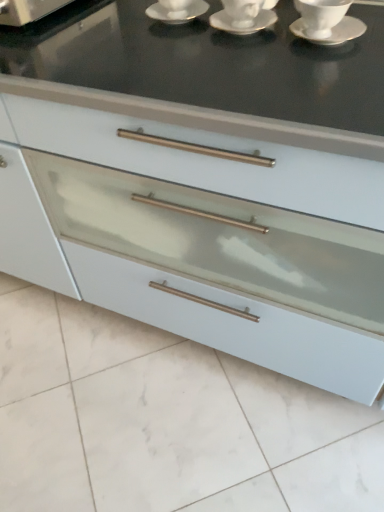
Question: Considering the relative sizes of white ceramic cup at upper right and white glossy saucer at upper right, which ranks as the first saucer in right-to-left order, in the image provided, is white ceramic cup at upper right thinner than white glossy saucer at upper right, which ranks as the first saucer in right-to-left order,?

Choices:
 (A) yes
 (B) no

Answer: (A)

Question: Is white ceramic cup at upper right facing away from white glossy saucer at upper right, which ranks as the first saucer in right-to-left order?

Choices:
 (A) yes
 (B) no

Answer: (B)

Question: Is white ceramic cup at upper right not close to white glossy saucer at upper right, the third saucer from the left?

Choices:
 (A) no
 (B) yes

Answer: (A)

Question: Is white ceramic cup at upper right smaller than white glossy saucer at upper right, the third saucer from the left?

Choices:
 (A) yes
 (B) no

Answer: (B)

Question: From a real-world perspective, is white ceramic cup at upper right positioned over white glossy saucer at upper right, which ranks as the first saucer in right-to-left order, based on gravity?

Choices:
 (A) no
 (B) yes

Answer: (B)

Question: Considering the positions of white ceramic cup at upper right and white ceramic saucer at upper center, the 1th saucer from the left, in the image, is white ceramic cup at upper right taller or shorter than white ceramic saucer at upper center, the 1th saucer from the left,?

Choices:
 (A) tall
 (B) short

Answer: (B)

Question: Looking at their shapes, would you say white ceramic cup at upper right is wider or thinner than white ceramic saucer at upper center, the 1th saucer from the left?

Choices:
 (A) wide
 (B) thin

Answer: (B)

Question: From the image's perspective, is white ceramic cup at upper right positioned above or below white ceramic saucer at upper center, which is the third saucer from right to left?

Choices:
 (A) below
 (B) above

Answer: (A)

Question: Is white ceramic cup at upper right inside or outside of white ceramic saucer at upper center, the 1th saucer from the left?

Choices:
 (A) outside
 (B) inside

Answer: (A)

Question: Is white ceramic saucer at upper center, which is the third saucer from right to left, bigger or smaller than white glossy saucer at upper right, the third saucer from the left?

Choices:
 (A) big
 (B) small

Answer: (A)

Question: In terms of height, does white ceramic saucer at upper center, the 1th saucer from the left, look taller or shorter compared to white glossy saucer at upper right, which ranks as the first saucer in right-to-left order?

Choices:
 (A) short
 (B) tall

Answer: (B)

Question: Relative to white glossy saucer at upper right, which ranks as the first saucer in right-to-left order, is white ceramic saucer at upper center, which is the third saucer from right to left, in front or behind?

Choices:
 (A) behind
 (B) front

Answer: (A)

Question: Is point (198, 7) closer or farther from the camera than point (331, 31)?

Choices:
 (A) farther
 (B) closer

Answer: (A)

Question: Looking at their shapes, would you say white ceramic saucer at center, the second saucer when ordered from right to left, is wider or thinner than white ceramic saucer at upper center, the 1th saucer from the left?

Choices:
 (A) thin
 (B) wide

Answer: (B)

Question: Is point (221, 23) positioned closer to the camera than point (163, 14)?

Choices:
 (A) farther
 (B) closer

Answer: (B)